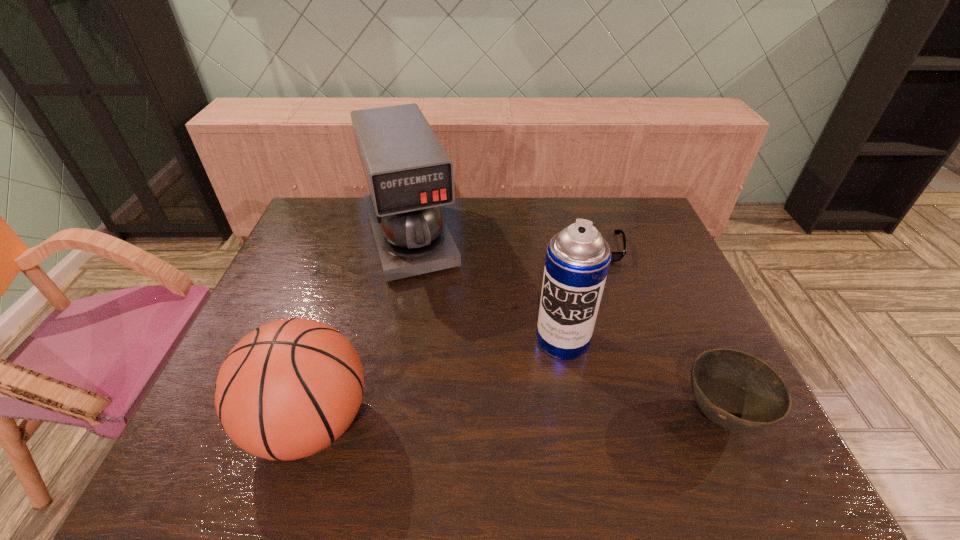
Where is `vacant space on the desktop that is between the basketball and the second shortest object and is positioned on the front-facing side of the shortest object`? The height and width of the screenshot is (540, 960). vacant space on the desktop that is between the basketball and the second shortest object and is positioned on the front-facing side of the shortest object is located at coordinates (577, 418).

Locate an element on the screen. The height and width of the screenshot is (540, 960). vacant space on the desktop that is between the basketball and the fourth tallest object and is positioned on the carafe side of the coffee maker is located at coordinates (477, 420).

You are a GUI agent. You are given a task and a screenshot of the screen. Output one action in this format:
    pyautogui.click(x=<x>, y=<y>)
    Task: Click on the vacant space on the desktop that is between the basketball and the second shortest object and is positioned on the label side of the third object from left to right
    
    Given the screenshot: What is the action you would take?
    pyautogui.click(x=533, y=419)